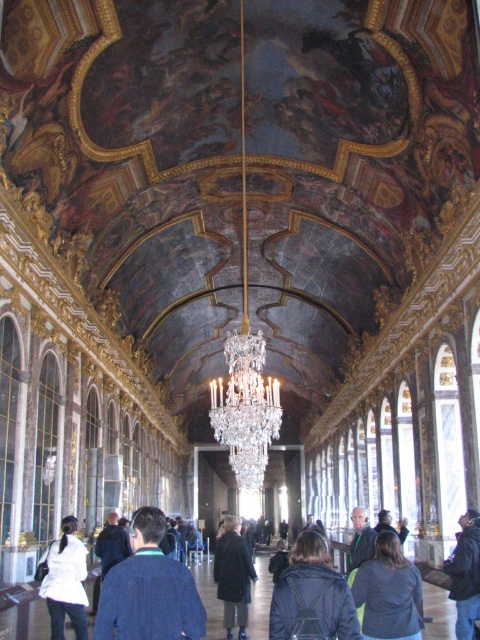
Question: Which object is farther from the camera taking this photo?

Choices:
 (A) dark blue jacket at center
 (B) dark gray jacket at lower center
 (C) clear crystal chandelier at center
 (D) green fabric coat at center

Answer: (C)

Question: Can you confirm if dark gray jacket at lower center is wider than white matte coat at center?

Choices:
 (A) no
 (B) yes

Answer: (A)

Question: Does dark gray jacket at lower center have a smaller size compared to dark blue coat at center?

Choices:
 (A) yes
 (B) no

Answer: (A)

Question: Which object is closer to the camera taking this photo?

Choices:
 (A) clear crystal chandelier at center
 (B) blue sweater at center
 (C) black leather jacket at lower right
 (D) dark blue jacket at center

Answer: (B)

Question: In this image, where is clear crystal chandelier at center located relative to dark blue jacket at center?

Choices:
 (A) above
 (B) below

Answer: (A)

Question: Which point is closer to the camera?

Choices:
 (A) (373, 560)
 (B) (116, 579)
 (C) (474, 573)
 (D) (368, 529)

Answer: (B)